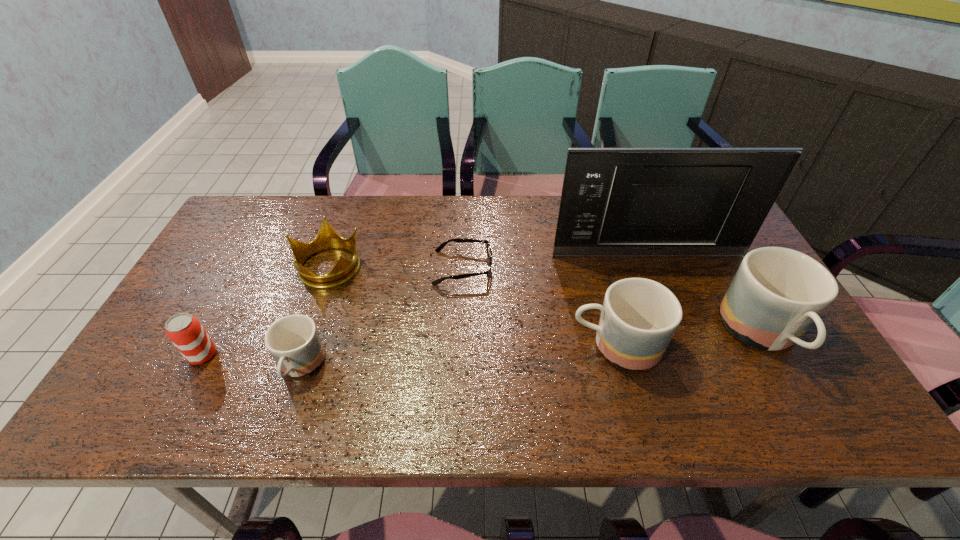
You are a GUI agent. You are given a task and a screenshot of the screen. Output one action in this format:
    pyautogui.click(x=<x>, y=<y>)
    Task: Click on the object located in the near left corner section of the desktop
    The height and width of the screenshot is (540, 960).
    Given the screenshot: What is the action you would take?
    pyautogui.click(x=187, y=334)

Locate an element on the screen. The height and width of the screenshot is (540, 960). object at the near right corner is located at coordinates (777, 293).

This screenshot has height=540, width=960. In the image, there is a desktop. Identify the location of vacant region at the far edge. [x=534, y=199].

Locate an element on the screen. The height and width of the screenshot is (540, 960). vacant space at the near edge is located at coordinates (635, 377).

Identify the location of vacant space at the left edge of the desktop. This screenshot has width=960, height=540. (146, 356).

Identify the location of free space at the far left corner of the desktop. (273, 212).

You are a GUI agent. You are given a task and a screenshot of the screen. Output one action in this format:
    pyautogui.click(x=<x>, y=<y>)
    Task: Click on the vacant space at the near right corner of the desktop
    Image resolution: width=960 pixels, height=540 pixels.
    Given the screenshot: What is the action you would take?
    pyautogui.click(x=795, y=366)

Identify the location of empty space between the rightmost mug and the second mug from right to left. coord(688,340).

This screenshot has width=960, height=540. I want to click on vacant region between the shortest mug and the shortest object, so click(381, 318).

Find the location of a particular element. The width and height of the screenshot is (960, 540). vacant space that is in between the fifth shortest object and the leftmost mug is located at coordinates (458, 356).